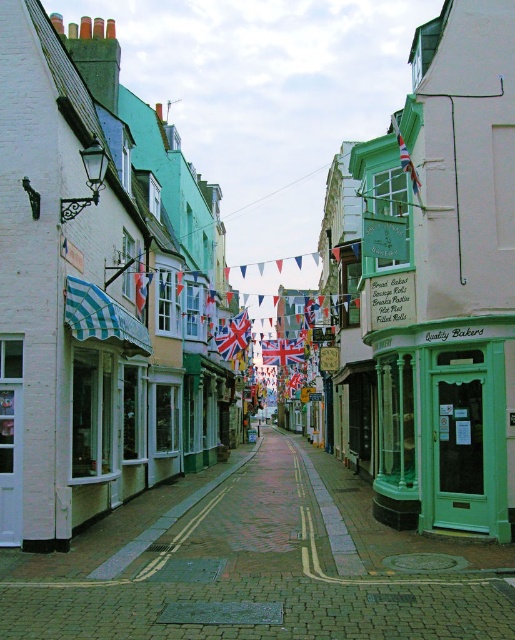
You are a tourist standing in the middle of the street looking towards the buildings. You see the green glass door at center and the union jack fabric flag at upper right. Which object is located higher up in the scene?

The union jack fabric flag at upper right is located higher up in the scene than the green glass door at center.

You are standing on the street and want to walk towards both the point at coordinates (x=235, y=621) and the point at coordinates (x=243, y=340). Which point will you reach first?

You will reach the point at coordinates (x=235, y=621) first because it is closer to you than the point at coordinates (x=243, y=340).